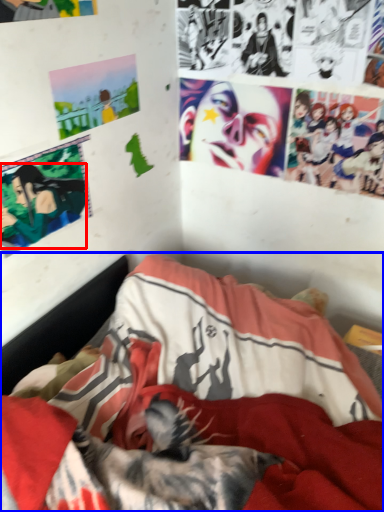
Question: Which point is closer to the camera, person (highlighted by a red box) or bed (highlighted by a blue box)?

Choices:
 (A) person
 (B) bed

Answer: (B)